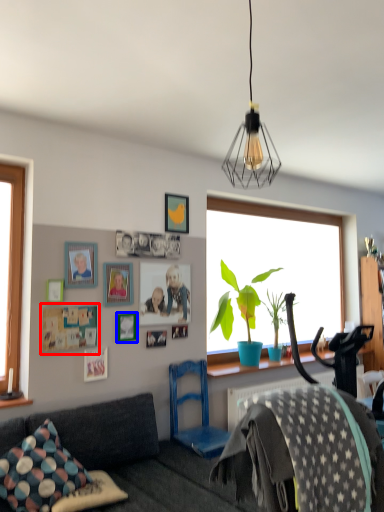
Question: Which object appears closest to the camera in this image, picture frame (highlighted by a red box) or picture frame (highlighted by a blue box)?

Choices:
 (A) picture frame
 (B) picture frame

Answer: (A)